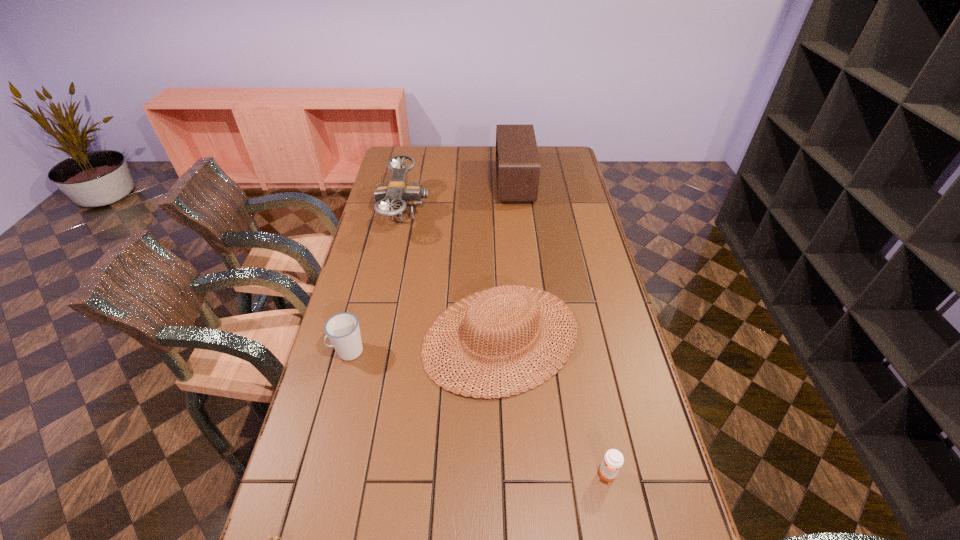
The height and width of the screenshot is (540, 960). Find the location of `free space located on the left of the sunhat`. free space located on the left of the sunhat is located at coordinates (394, 337).

This screenshot has width=960, height=540. What are the coordinates of `free space located 0.350m on the left of the fifth tallest object` in the screenshot? It's located at (451, 475).

You are a GUI agent. You are given a task and a screenshot of the screen. Output one action in this format:
    pyautogui.click(x=<x>, y=<y>)
    Task: Click on the object located in the far edge section of the desktop
    This screenshot has height=540, width=960.
    Given the screenshot: What is the action you would take?
    pyautogui.click(x=517, y=159)

Find the location of a particular element. drone at the left edge is located at coordinates (397, 192).

Find the location of a particular element. Image resolution: width=960 pixels, height=540 pixels. cup that is at the left edge is located at coordinates (342, 329).

Locate an element on the screen. sunhat that is at the right edge is located at coordinates (529, 302).

Where is `medicine present at the right edge`? The height and width of the screenshot is (540, 960). medicine present at the right edge is located at coordinates (613, 460).

Where is `free space at the far edge`? free space at the far edge is located at coordinates (478, 165).

Find the location of `vacant space at the left edge of the desktop`. vacant space at the left edge of the desktop is located at coordinates (320, 523).

This screenshot has height=540, width=960. Find the location of `vacant space at the right edge of the desktop`. vacant space at the right edge of the desktop is located at coordinates (587, 200).